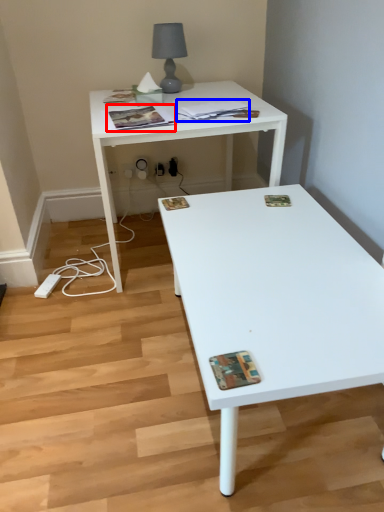
Question: Which object is further to the camera taking this photo, magazine (highlighted by a red box) or magazine (highlighted by a blue box)?

Choices:
 (A) magazine
 (B) magazine

Answer: (B)